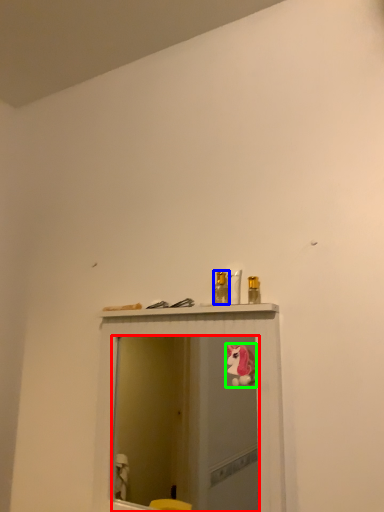
Question: Which object is the farthest from mirror (highlighted by a red box)? Choose among these: toiletry (highlighted by a blue box) or animal (highlighted by a green box).

Choices:
 (A) toiletry
 (B) animal

Answer: (A)